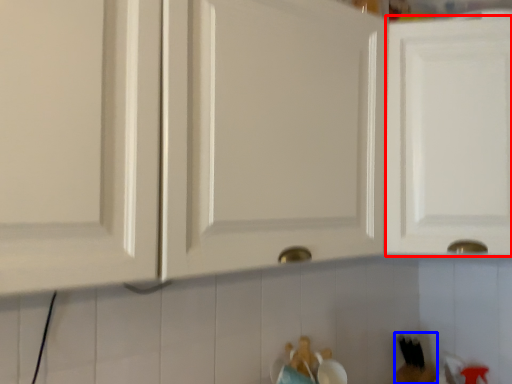
Question: Which of the following is the farthest to the observer, cabinetry (highlighted by a red box) or toy (highlighted by a blue box)?

Choices:
 (A) cabinetry
 (B) toy

Answer: (B)